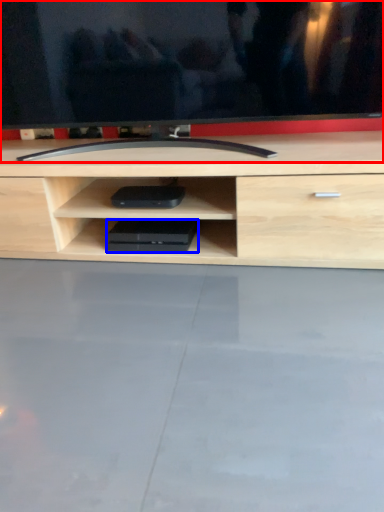
Question: Which object appears closest to the camera in this image, television (highlighted by a red box) or equipment (highlighted by a blue box)?

Choices:
 (A) television
 (B) equipment

Answer: (A)